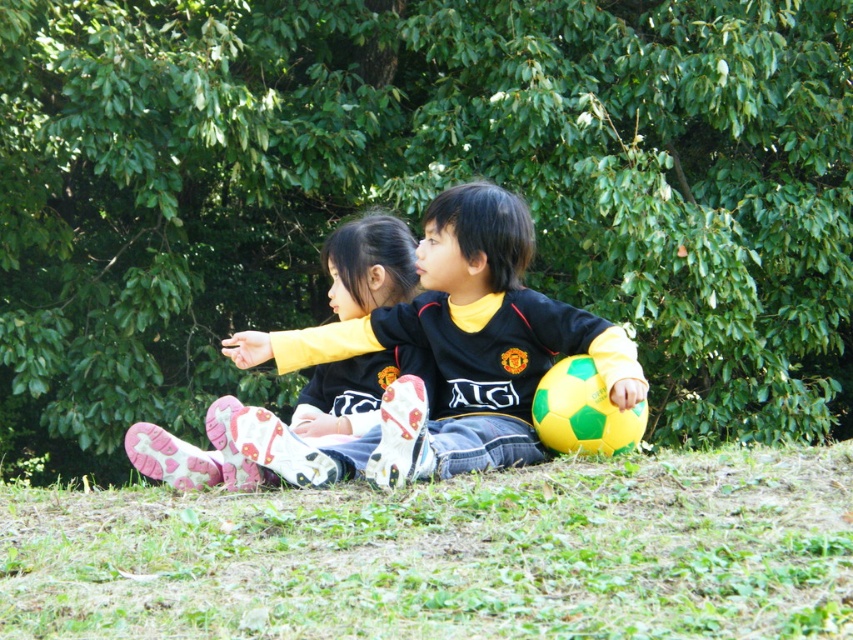
You are a photographer trying to capture both the green leafy tree at center and the black jersey at center in a single shot. Based on their sizes, which object should you focus on first to ensure both are in frame?

The green leafy tree at center is much taller than the black jersey at center, so you should focus on the tree first to ensure its full height is captured while still including the black jersey at center in the frame.